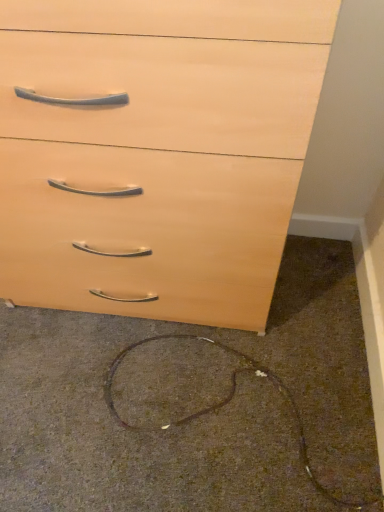
Where is `vacant space to the right of light wood/finish chest of drawers at upper center`? vacant space to the right of light wood/finish chest of drawers at upper center is located at coordinates (317, 321).